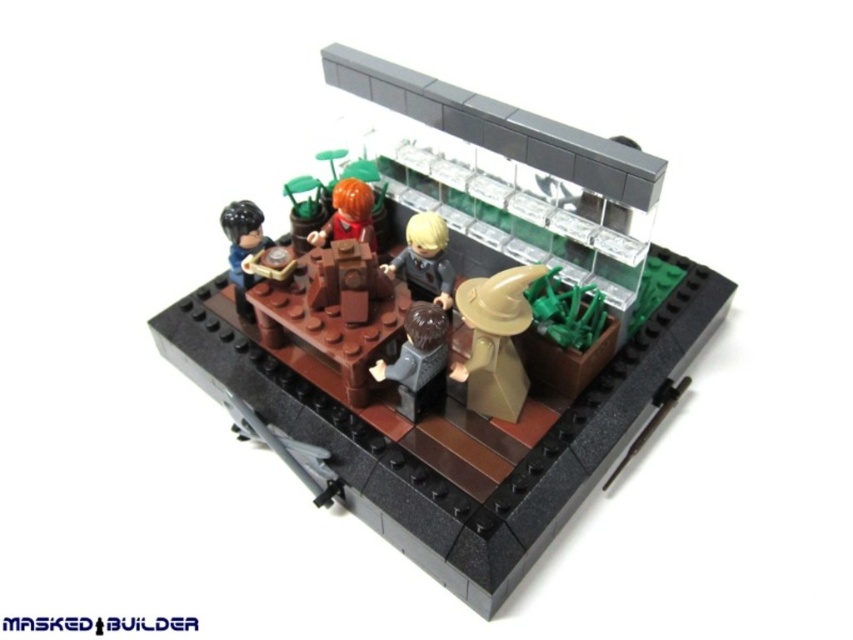
You are a photographer standing 1 meter away from the LEGO diorama. You want to take a closeup photo of the brown matte wizard hat at center without including any other minifigures. Is the hat within your camera lens range if the minimum focus distance is 1 meter?

The brown matte wizard hat at center is exactly 1.01 meters away from the viewer. Since the minimum focus distance is 1 meter, the camera can focus on the hat as it is just slightly beyond the minimum distance, allowing for a clear closeup without including other elements.

You are a photographer standing at the camera position. You want to take a photo of the brown matte wizard hat at center. Is the hat in focus if the camera has a depth of field that can only capture objects within 1 meter? Please explain your answer.

The brown matte wizard hat at center and camera are 1.01 meters apart from each other. Since the distance exceeds the camera depth of field limit of 1 meter, the hat will be slightly out of focus.

You are a tiny LEGO figure standing at point A, which is at coordinates point [254,225]. You want to move to the back of the LEGO diorama. Which direction should you move relative to point [335,230]?

Since point [254,225] is in front of point [335,230], you should move backward away from point [335,230] to reach the back of the LEGO diorama.